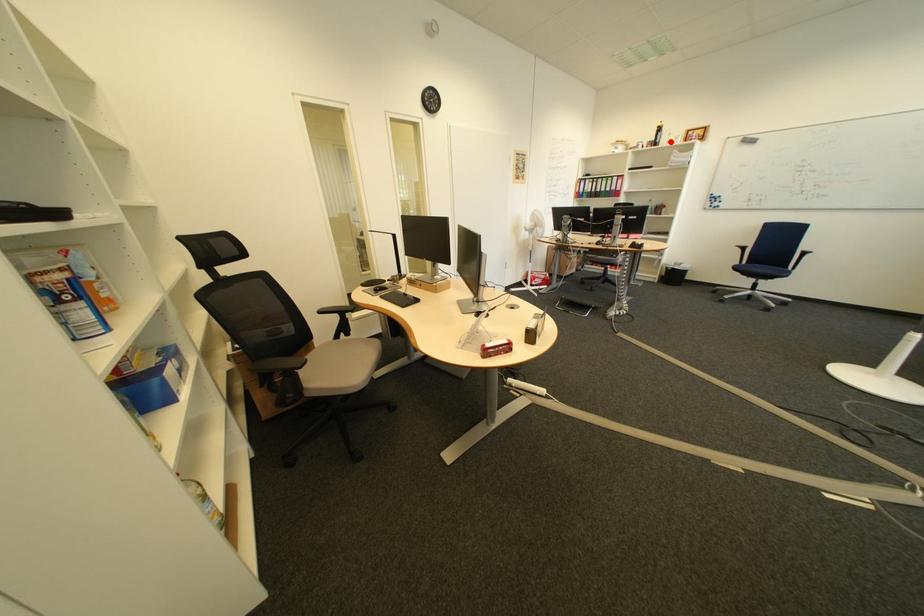
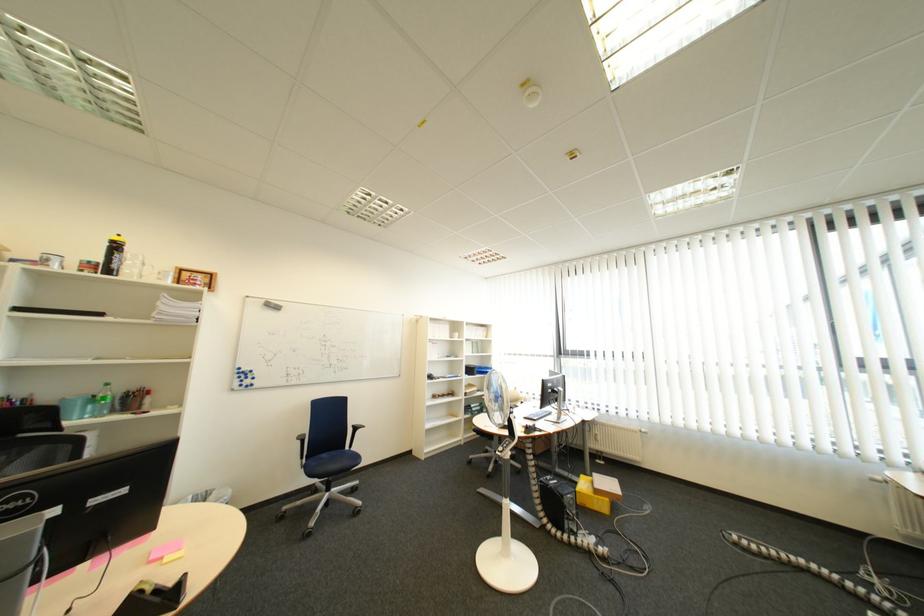
Locate, in the second image, the point that corresponds to the highlighted location in the first image.

(128, 267)